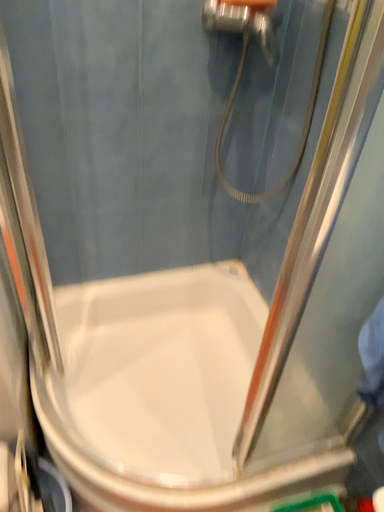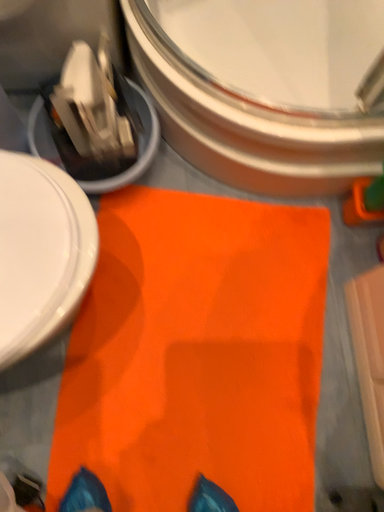
Question: Which way did the camera rotate in the video?

Choices:
 (A) rotated right
 (B) rotated left

Answer: (B)